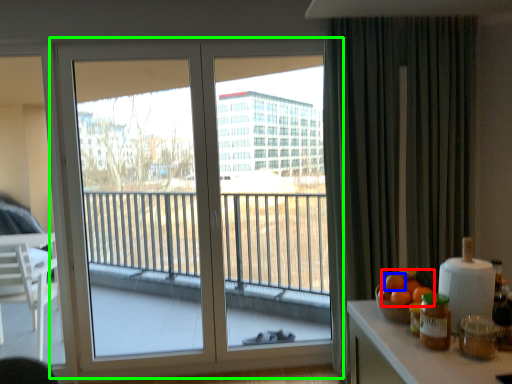
Question: Estimate the real-world distances between objects in this image. Which object is farther from orange (highlighted by a red box), orange (highlighted by a blue box) or window (highlighted by a green box)?

Choices:
 (A) orange
 (B) window

Answer: (B)